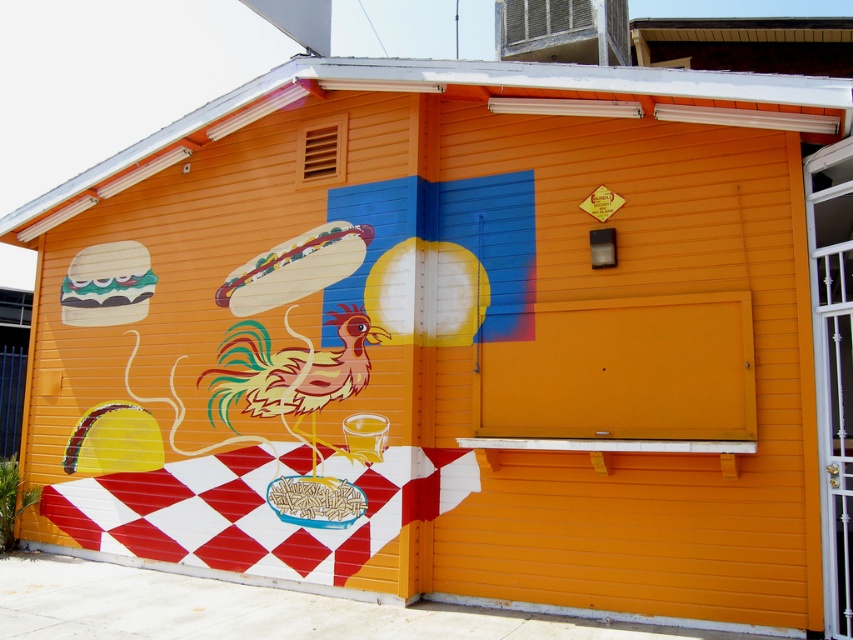
Who is higher up, orange matte garage door at center or wooden hot dog at center?

wooden hot dog at center is higher up.

Does point (735, 380) lie behind point (344, 268)?

No, it is not.

Does point (662, 408) come in front of point (308, 272)?

Yes.

Locate an element on the screen. orange matte garage door at center is located at coordinates (624, 371).